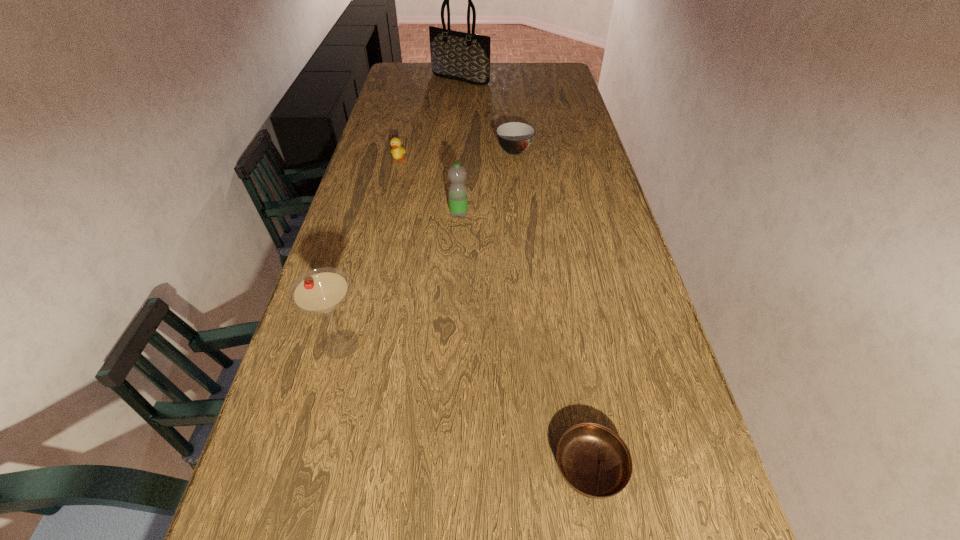
Find the location of `vacant space located on the front of the fifth farthest object`. vacant space located on the front of the fifth farthest object is located at coordinates (299, 505).

The width and height of the screenshot is (960, 540). I want to click on free space located on the back of the water bottle, so click(463, 147).

Where is `free space located on the front-facing side of the duckling`? The image size is (960, 540). free space located on the front-facing side of the duckling is located at coordinates tap(386, 214).

Image resolution: width=960 pixels, height=540 pixels. I want to click on vacant region located 0.180m on the right of the farther soup bowl, so click(x=583, y=151).

What are the coordinates of `free space located on the back of the nearer soup bowl` in the screenshot? It's located at 564,311.

At what (x,y) coordinates should I click in order to perform the action: click on object at the far edge. Please return your answer as a coordinate pair (x, y). The image size is (960, 540). Looking at the image, I should click on (456, 55).

At what (x,y) coordinates should I click in order to perform the action: click on martini that is at the left edge. Please return your answer as a coordinate pair (x, y). Looking at the image, I should click on (320, 291).

I want to click on duckling that is at the left edge, so click(397, 151).

At what (x,y) coordinates should I click in order to perform the action: click on object located at the right edge. Please return your answer as a coordinate pair (x, y). Looking at the image, I should click on (594, 461).

You are a GUI agent. You are given a task and a screenshot of the screen. Output one action in this format:
    pyautogui.click(x=<x>, y=<y>)
    Task: Click on the vacant space at the far edge
    The height and width of the screenshot is (540, 960).
    Given the screenshot: What is the action you would take?
    (x=516, y=80)